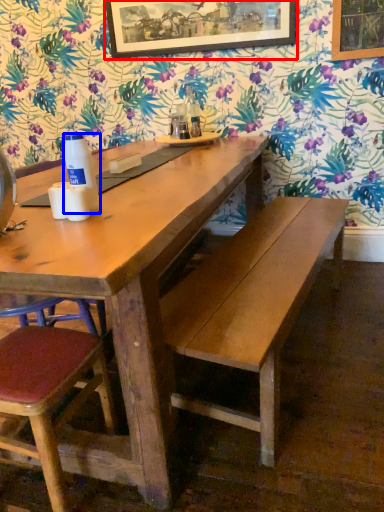
Question: Which of the following is the farthest to the observer, picture frame (highlighted by a red box) or bottle (highlighted by a blue box)?

Choices:
 (A) picture frame
 (B) bottle

Answer: (A)